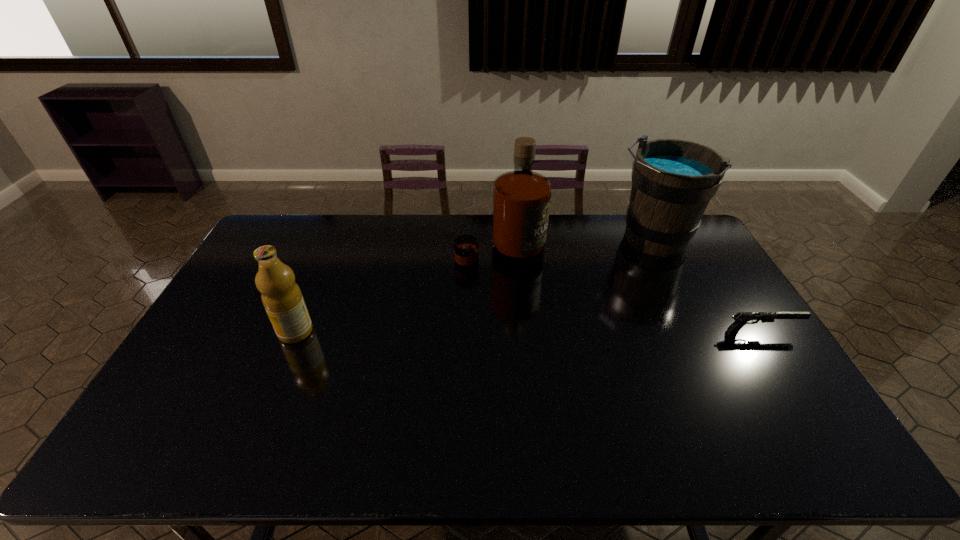
Locate an element on the screen. The width and height of the screenshot is (960, 540). free point between the third shortest object and the gun is located at coordinates click(x=707, y=286).

The width and height of the screenshot is (960, 540). I want to click on empty space that is in between the olive oil and the gun, so click(528, 332).

The width and height of the screenshot is (960, 540). I want to click on free space between the wine bucket and the gun, so click(707, 286).

Choose which object is the nearest neighbor to the leftmost object. Please provide its 2D coordinates. Your answer should be formatted as a tuple, i.e. [(x, y)], where the tuple contains the x and y coordinates of a point satisfying the conditions above.

[(521, 198)]

Find the location of a particular element. object that stands as the second closest to the second object from left to right is located at coordinates (282, 298).

This screenshot has width=960, height=540. In order to click on vacant space that satisfies the following two spatial constraints: 1. on the front side of the gun; 2. at the muzzle end of the third shortest object in this screenshot , I will do `click(699, 332)`.